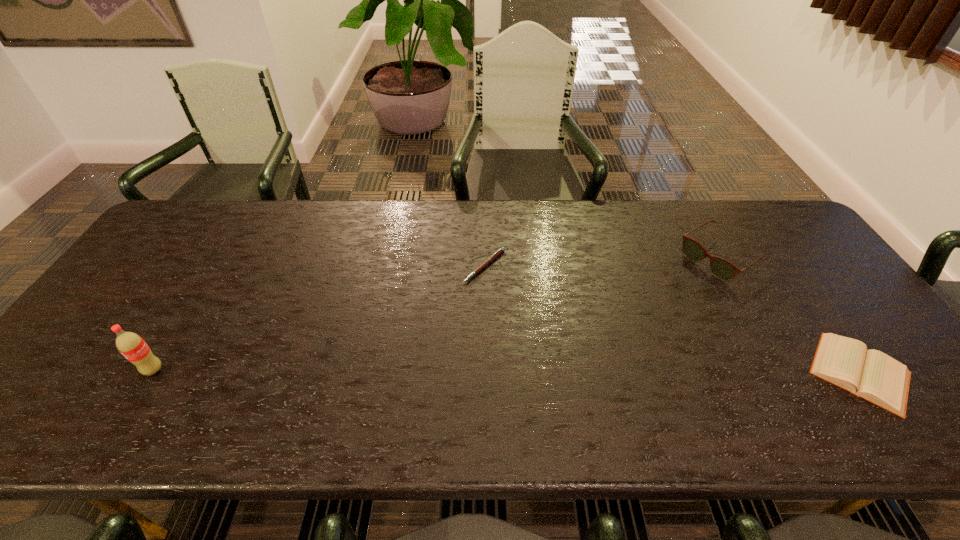
What are the coordinates of `vacant area located at the nib of the shortest object` in the screenshot? It's located at (534, 372).

Find the location of `vacant space located 0.070m at the front view of the second tallest object`. vacant space located 0.070m at the front view of the second tallest object is located at coordinates (680, 285).

The width and height of the screenshot is (960, 540). I want to click on blank area located at the front view of the second tallest object, so click(x=636, y=313).

At what (x,y) coordinates should I click in order to perform the action: click on free spot located 0.080m at the front view of the second tallest object. Please return your answer as a coordinate pair (x, y). This screenshot has height=540, width=960. Looking at the image, I should click on (677, 286).

Find the location of a particular element. Image resolution: width=960 pixels, height=540 pixels. object at the far edge is located at coordinates (721, 268).

Identify the location of soda that is at the near edge. Image resolution: width=960 pixels, height=540 pixels. (131, 345).

This screenshot has width=960, height=540. Find the location of `diary that is at the near edge`. diary that is at the near edge is located at coordinates (872, 375).

Where is `object located at the right edge`? object located at the right edge is located at coordinates (872, 375).

Find the location of a particular element. object positioned at the near right corner is located at coordinates (872, 375).

The width and height of the screenshot is (960, 540). In the image, there is a desktop. What are the coordinates of `vacant space at the far edge` in the screenshot? It's located at point(336,212).